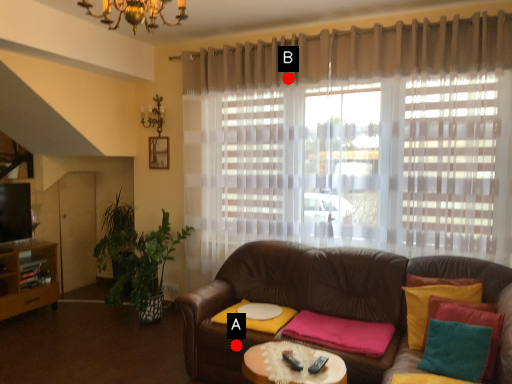
Question: Two points are circled on the image, labeled by A and B beside each circle. Among these points, which one is farthest from the camera?

Choices:
 (A) A is further
 (B) B is further

Answer: (B)